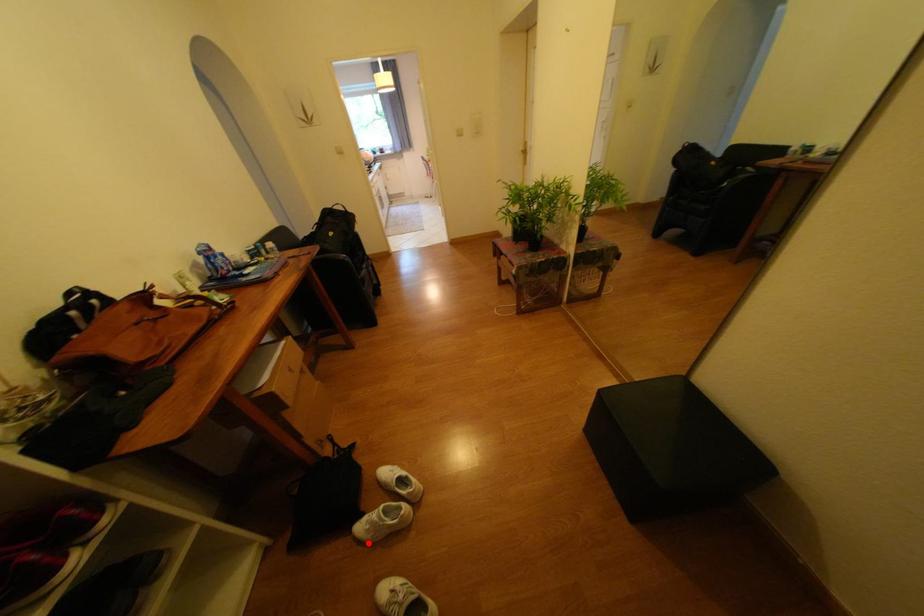
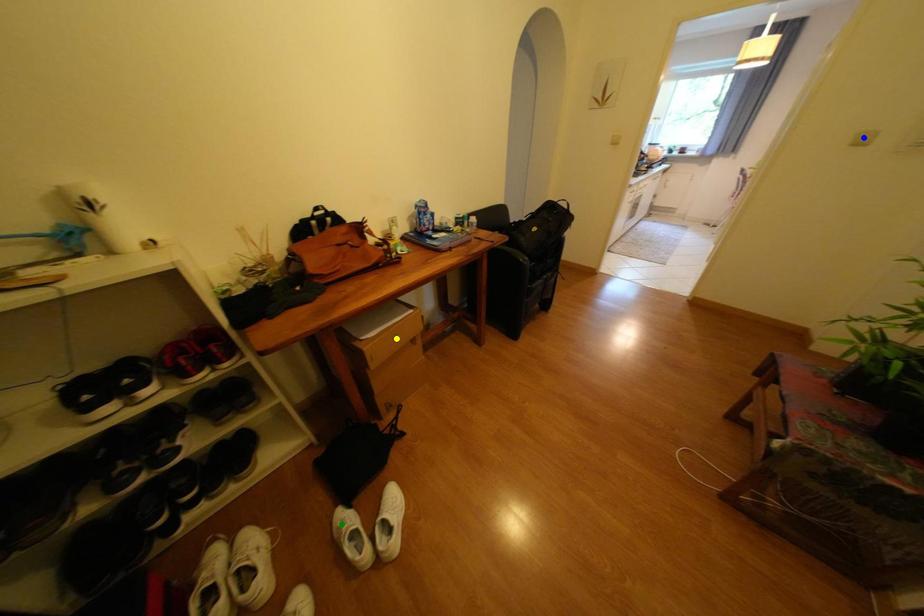
Question: I am providing you with two images of the same scene from different viewpoints. A red point is marked on the first image. You are given multiple points on the second image. In image 2, which mark is for the same physical point as the one in image 1?

Choices:
 (A) green point
 (B) yellow point
 (C) blue point

Answer: (A)